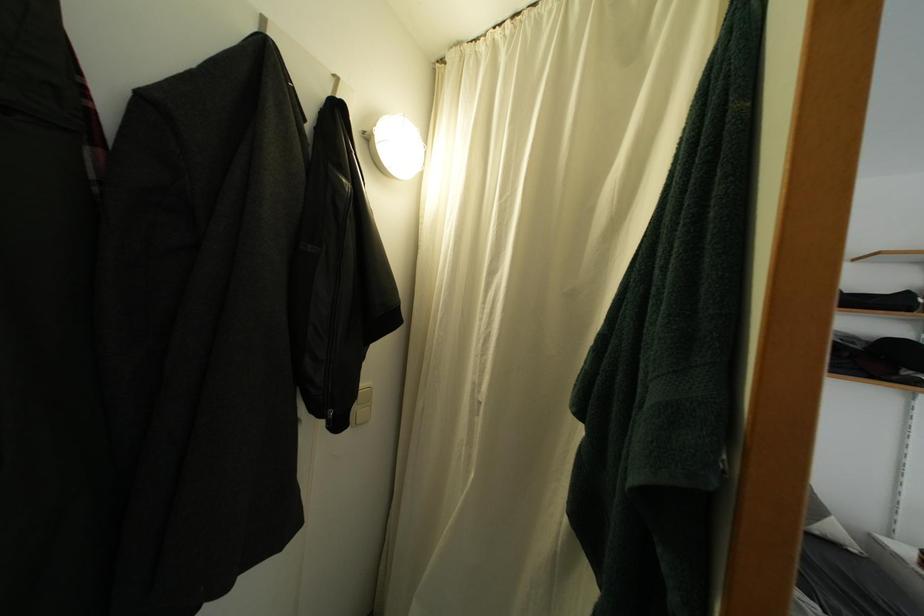
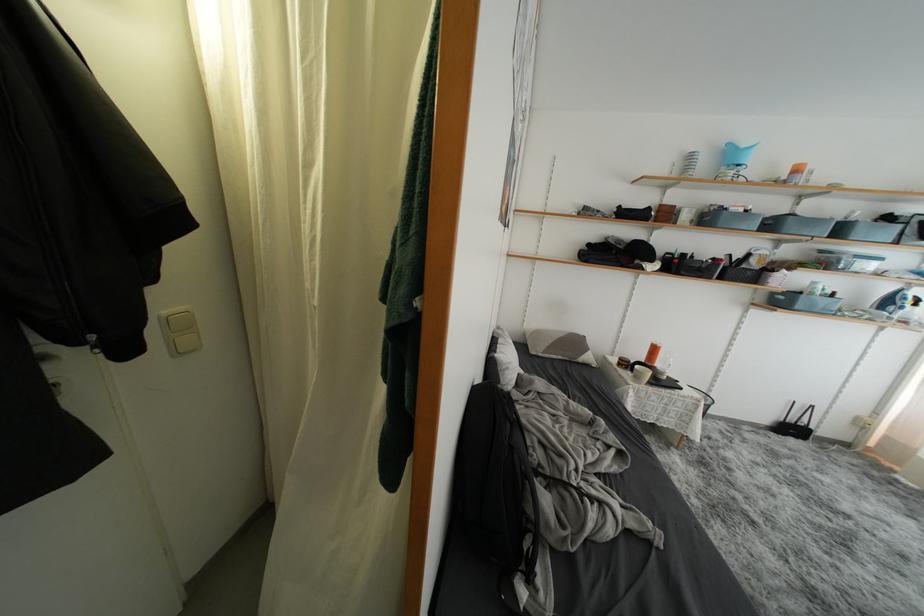
In a continuous first-person perspective shot, in which direction is the camera moving?

The cameraman walked toward right, backward.